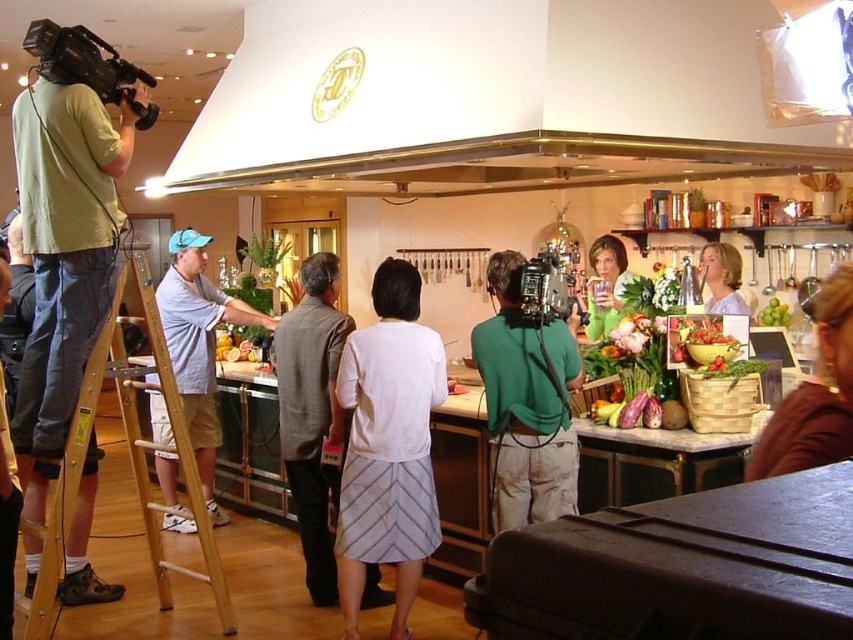
Question: Is white glossy exhaust hood at upper center positioned in front of black matte video camera at upper left?

Choices:
 (A) no
 (B) yes

Answer: (A)

Question: Which object is positioned farthest from the white textured dress at center?

Choices:
 (A) light green t-shirt at left
 (B) green fabric shirt at center

Answer: (A)

Question: From the image, what is the correct spatial relationship of blue denim shirt at left in relation to black matte video camera at upper left?

Choices:
 (A) left
 (B) right

Answer: (B)

Question: Observing the image, what is the correct spatial positioning of white glossy exhaust hood at upper center in reference to light green t-shirt at left?

Choices:
 (A) left
 (B) right

Answer: (B)

Question: Which point is closer to the camera?

Choices:
 (A) (593, 145)
 (B) (614, 237)
 (C) (834, 380)
 (D) (26, 404)

Answer: (C)

Question: Which object appears farthest from the camera in this image?

Choices:
 (A) blue denim shirt at left
 (B) wooden ladder at left
 (C) metallic silver video camera at center
 (D) matte green sweater at center

Answer: (A)